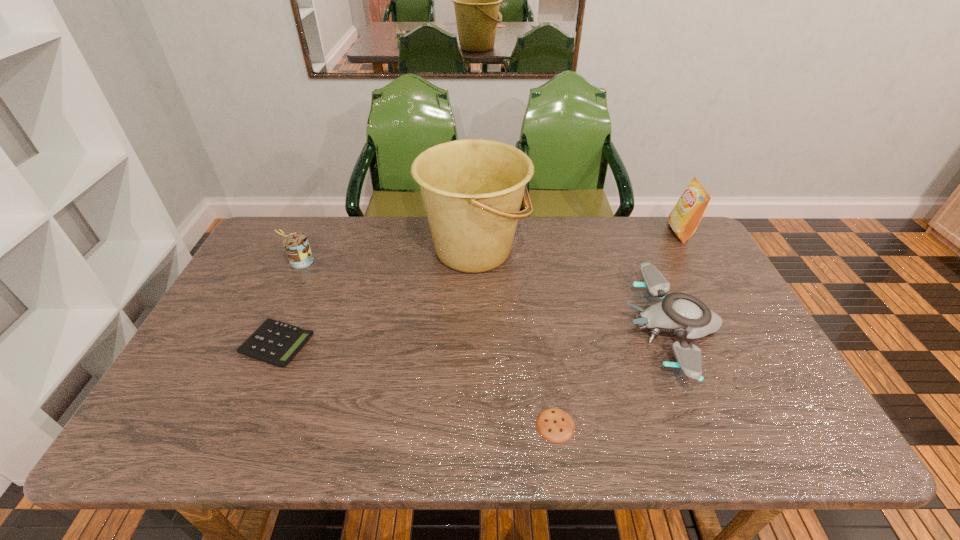
This screenshot has width=960, height=540. Identify the location of the tallest object. (472, 189).

This screenshot has width=960, height=540. In order to click on the fifth shortest object in this screenshot , I will do 685,217.

Locate an element on the screen. Image resolution: width=960 pixels, height=540 pixels. crisp (potato chip) is located at coordinates (685, 217).

Locate an element on the screen. The image size is (960, 540). can is located at coordinates (296, 245).

Where is `the second object from right to left`? the second object from right to left is located at coordinates (683, 314).

Find the location of a particular element. This screenshot has height=540, width=960. the fourth tallest object is located at coordinates (683, 314).

This screenshot has height=540, width=960. Find the location of `calculator`. calculator is located at coordinates pos(274,342).

Identify the location of the nearest object. This screenshot has height=540, width=960. (555, 425).

Where is `the shortest object`? The width and height of the screenshot is (960, 540). the shortest object is located at coordinates (555, 425).

At what (x,y) coordinates should I click in order to perform the action: click on free space located on the side of the bucket with the handle. Please return your answer as a coordinate pair (x, y). This screenshot has height=540, width=960. Looking at the image, I should click on pyautogui.click(x=624, y=250).